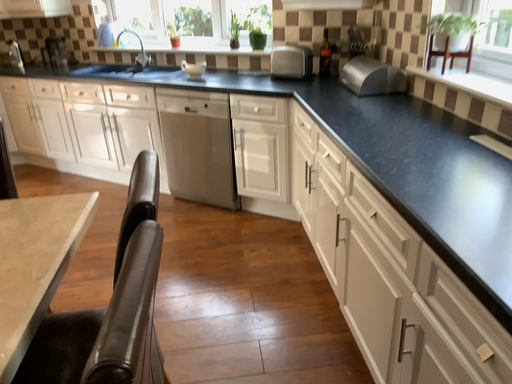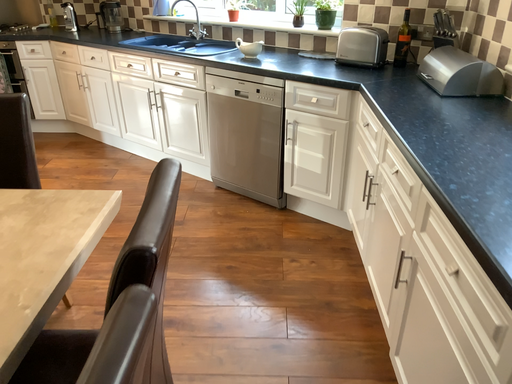
Question: Which way did the camera rotate in the video?

Choices:
 (A) rotated left
 (B) rotated right

Answer: (A)